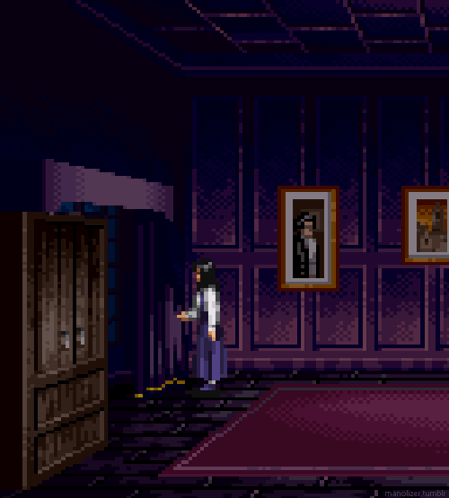
In order to click on pink/purple rug in this screenshot , I will do `click(283, 402)`, `click(242, 439)`, `click(219, 461)`, `click(283, 457)`, `click(406, 457)`, `click(411, 406)`, `click(337, 406)`, `click(344, 455)`, `click(363, 439)`.